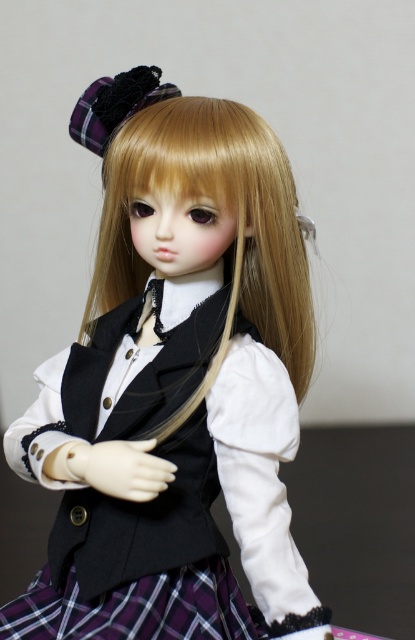
Question: Which point is farther from the camera taking this photo?

Choices:
 (A) (144, 275)
 (B) (219, 632)

Answer: (A)

Question: Is blonde silky hair at center thinner than plaid fabric at center?

Choices:
 (A) no
 (B) yes

Answer: (A)

Question: Among these points, which one is farthest from the camera?

Choices:
 (A) (38, 602)
 (B) (290, 349)

Answer: (B)

Question: Can you confirm if matte black vest at center is positioned to the left of blonde silky hair at center?

Choices:
 (A) yes
 (B) no

Answer: (B)

Question: Is blonde silky hair at center bigger than plaid fabric at center?

Choices:
 (A) yes
 (B) no

Answer: (A)

Question: Which object is farther from the camera taking this photo?

Choices:
 (A) plaid fabric at center
 (B) blonde silky hair at center

Answer: (B)